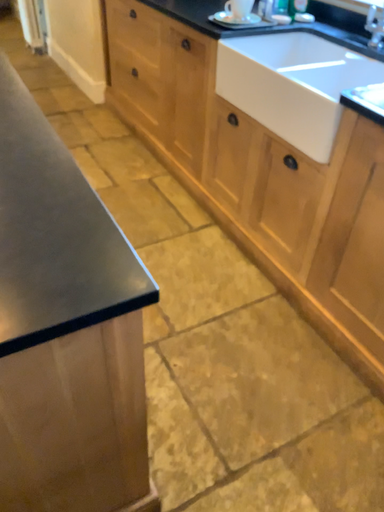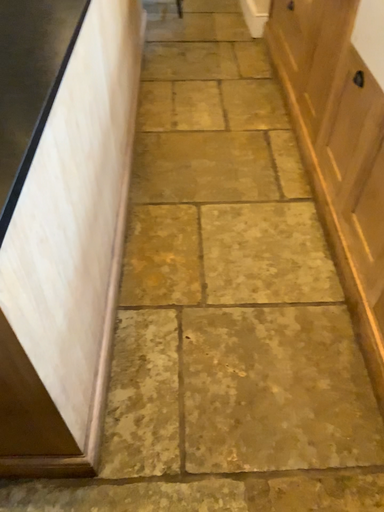
Question: Which way did the camera rotate in the video?

Choices:
 (A) rotated right
 (B) rotated left

Answer: (B)